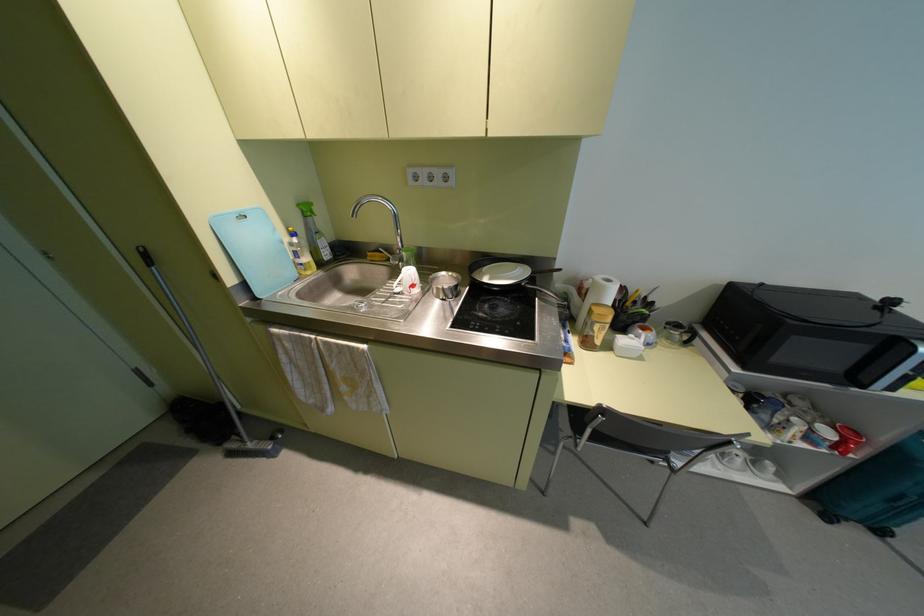
Describe the element at coordinates (398, 253) in the screenshot. I see `the faucet handle` at that location.